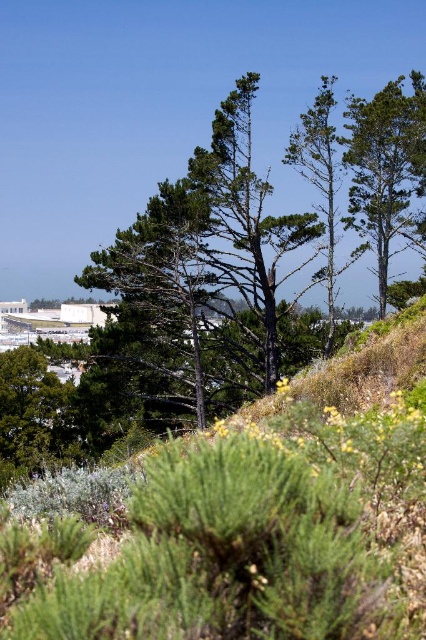
You are an environmental scientist assessing the vegetation in this landscape. You observe the green matte tree at upper right and the green matte tree at center. Which tree would you expect to cast a longer shadow during midday? Please explain your reasoning based on their positions and characteristics.

The green matte tree at upper right has a greater height compared to the green matte tree at center. Since taller objects cast longer shadows, the green matte tree at upper right would cast a longer shadow during midday.

You are standing at the point with coordinates (385,164) in this landscape. What object is located exactly at this point?

At point (385,164) lies the green matte tree at upper right.